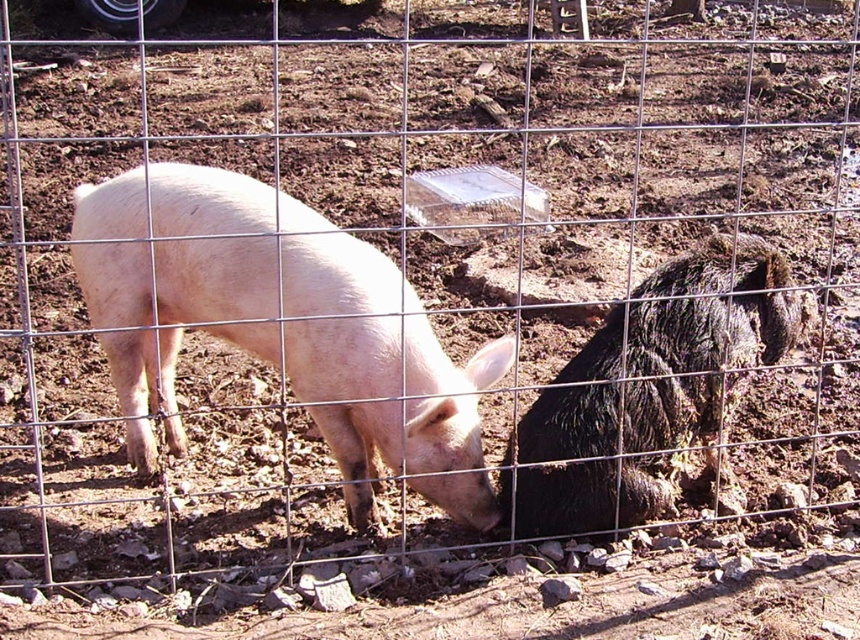
Who is shorter, matte pink pig at center or shaggy black pig at right?

shaggy black pig at right is shorter.

The width and height of the screenshot is (860, 640). What do you see at coordinates (384, 378) in the screenshot? I see `matte pink pig at center` at bounding box center [384, 378].

At what (x,y) coordinates should I click in order to perform the action: click on matte pink pig at center. Please return your answer as a coordinate pair (x, y). This screenshot has height=640, width=860. Looking at the image, I should click on (384, 378).